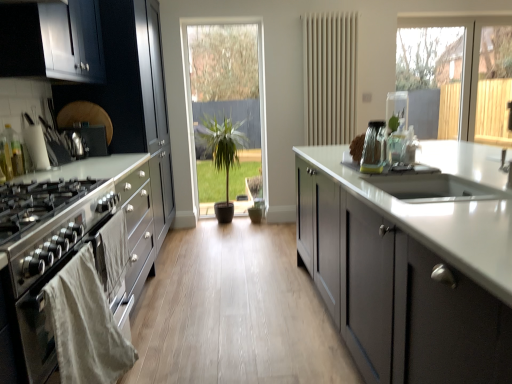
Locate an element on the screen. vacant space in front of green matte plant at center is located at coordinates (224, 233).